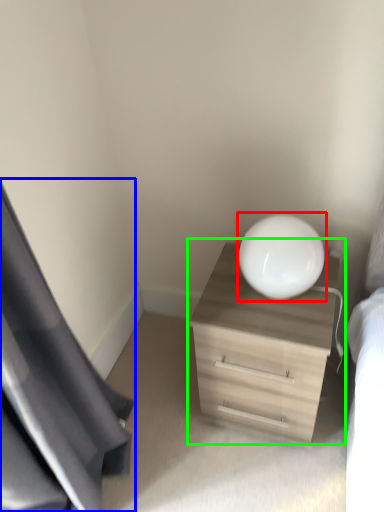
Question: Which is nearer to the round table (highlighted by a red box)? curtain (highlighted by a blue box) or dresser (highlighted by a green box).

Choices:
 (A) curtain
 (B) dresser

Answer: (B)